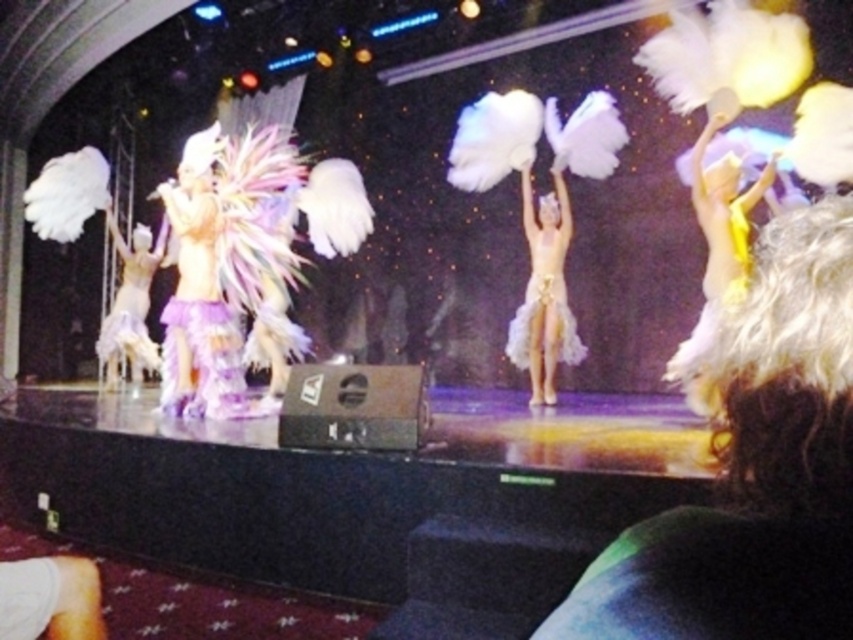
Question: Can you confirm if white curly hair at upper right is positioned below white feathered costume at left?

Choices:
 (A) yes
 (B) no

Answer: (A)

Question: Estimate the real-world distances between objects in this image. Which object is closer to the white feathered costume at left?

Choices:
 (A) white curly hair at upper right
 (B) white feathered costume at center

Answer: (B)

Question: Which point is farther from the camera taking this photo?

Choices:
 (A) tap(665, 625)
 (B) tap(131, 317)

Answer: (B)

Question: Is the position of white curly hair at upper right less distant than that of white feathered costume at center?

Choices:
 (A) no
 (B) yes

Answer: (B)

Question: Does white feathered costume at center come in front of white feathered costume at left?

Choices:
 (A) no
 (B) yes

Answer: (B)

Question: Which is farther from the white curly hair at upper right?

Choices:
 (A) white feathered costume at left
 (B) white feathered costume at center

Answer: (A)